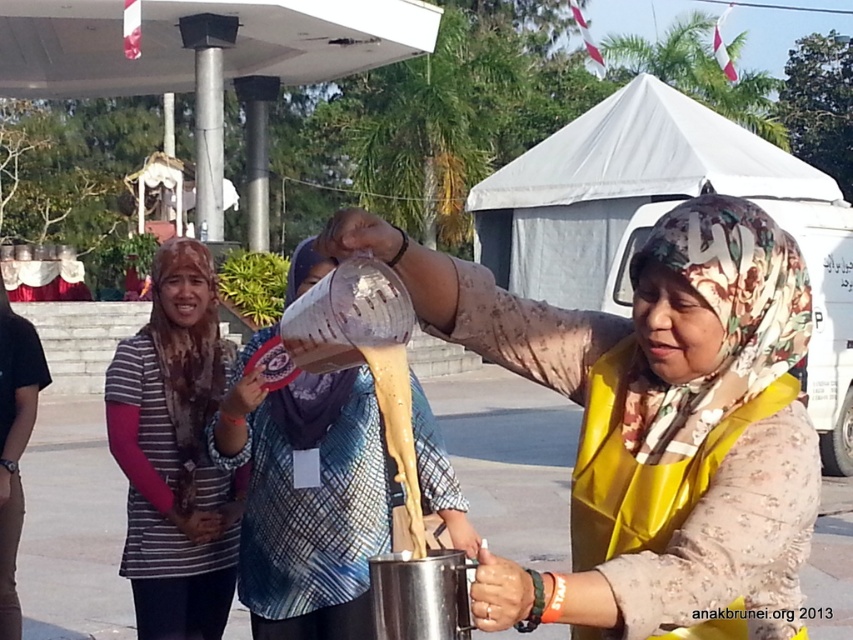
Question: Estimate the real-world distances between objects in this image. Which object is farther from the matte yellow apron at center?

Choices:
 (A) matte plastic container at center
 (B) striped fabric headscarf at center

Answer: (B)

Question: Which point is farther from the camera taking this photo?

Choices:
 (A) (163, 449)
 (B) (289, 566)

Answer: (A)

Question: Does matte yellow apron at center appear on the right side of striped fabric headscarf at center?

Choices:
 (A) no
 (B) yes

Answer: (B)

Question: Which point is farther to the camera?

Choices:
 (A) matte plastic container at center
 (B) matte yellow apron at center

Answer: (A)

Question: Is matte yellow apron at center wider than striped fabric headscarf at center?

Choices:
 (A) no
 (B) yes

Answer: (B)

Question: In this image, where is matte plastic container at center located relative to striped fabric headscarf at center?

Choices:
 (A) above
 (B) below

Answer: (A)